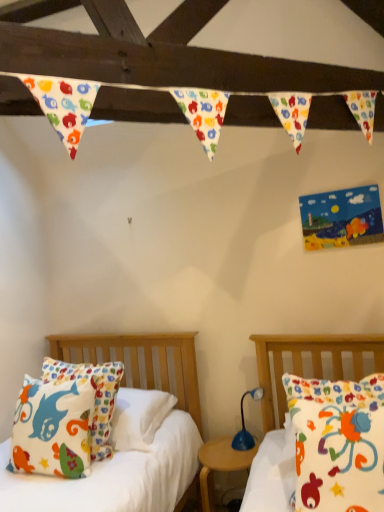
I want to click on vacant position to the left of blue plastic lamp at center, so click(x=218, y=450).